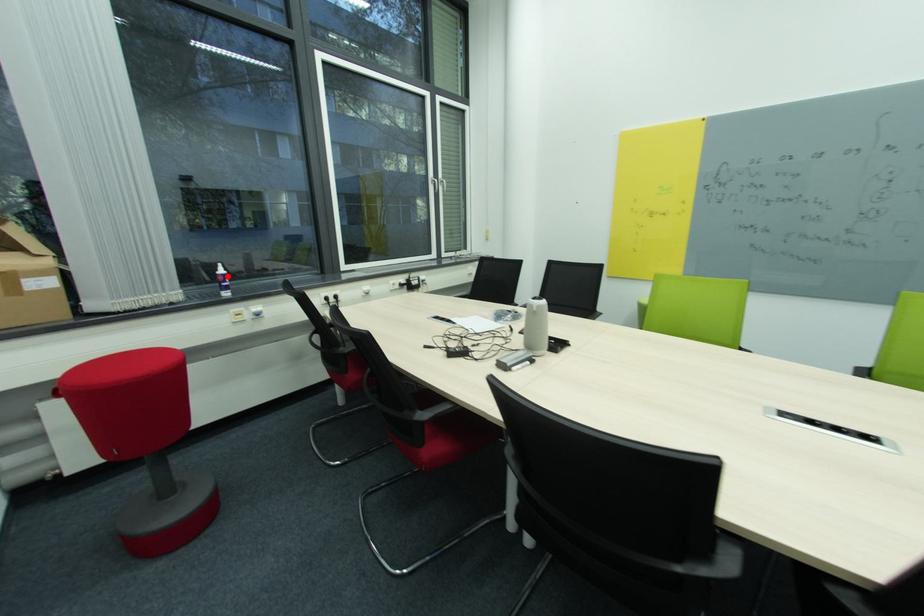
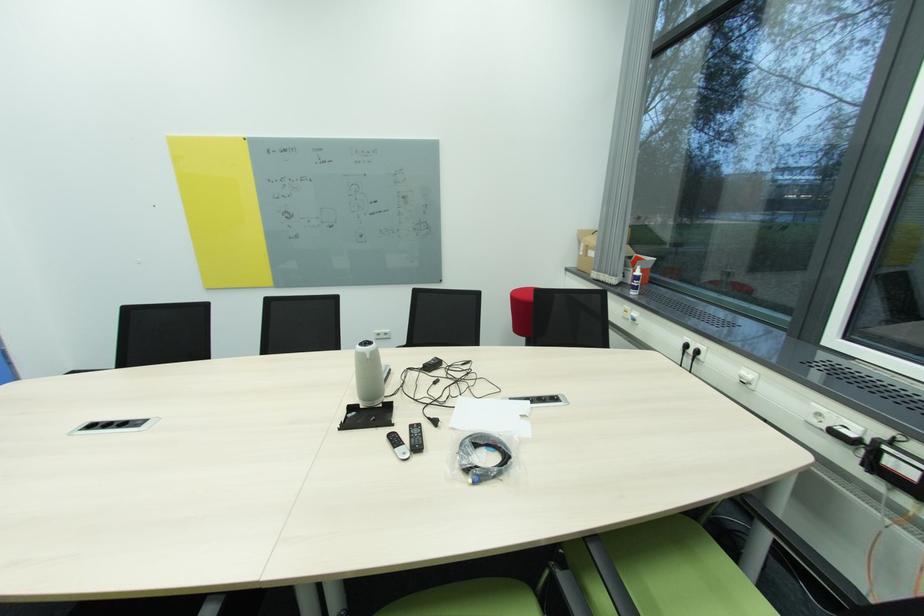
Find the pixel in the second image that matches the highlighted location in the first image.

(639, 277)